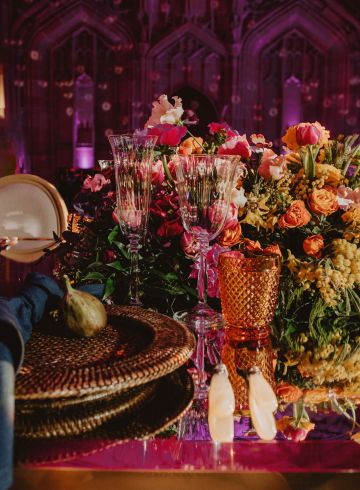
You are a GUI agent. You are given a task and a screenshot of the screen. Output one action in this format:
    pyautogui.click(x=<x>, y=<y>)
    Task: Click on the dried flowers
    This screenshot has height=490, width=360.
    Given the screenshot: What is the action you would take?
    pyautogui.click(x=259, y=218), pyautogui.click(x=350, y=263), pyautogui.click(x=309, y=276), pyautogui.click(x=325, y=369), pyautogui.click(x=325, y=171)